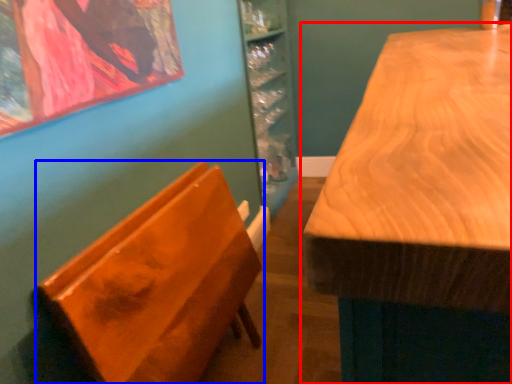
Question: Which object appears closest to the camera in this image, table (highlighted by a red box) or furniture (highlighted by a blue box)?

Choices:
 (A) table
 (B) furniture

Answer: (A)